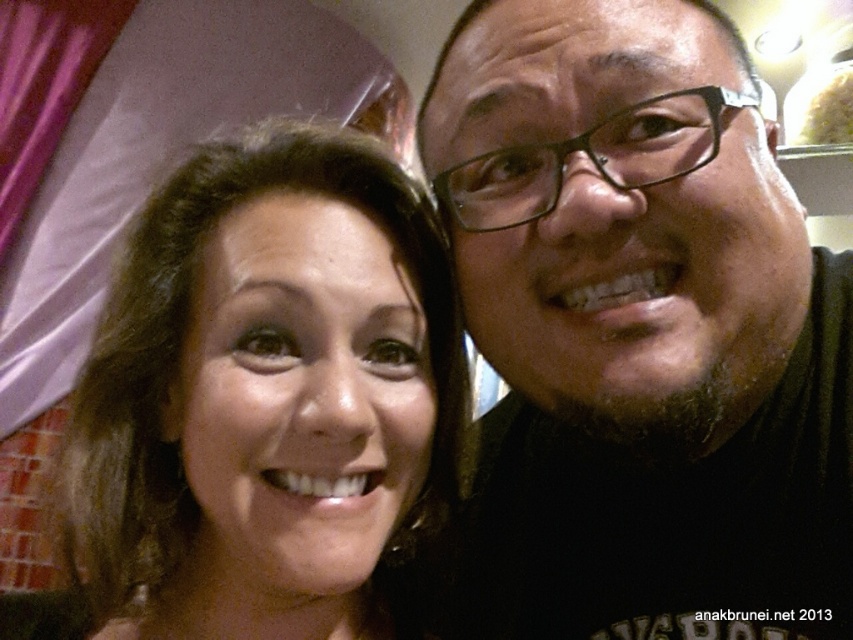
Who is more distant from viewer, (651, 122) or (219, 353)?

The point (651, 122) is more distant.

Can you confirm if black matte glasses at upper right is positioned to the left of matte brown hair at center?

No, black matte glasses at upper right is not to the left of matte brown hair at center.

Identify the location of black matte glasses at upper right. (640, 332).